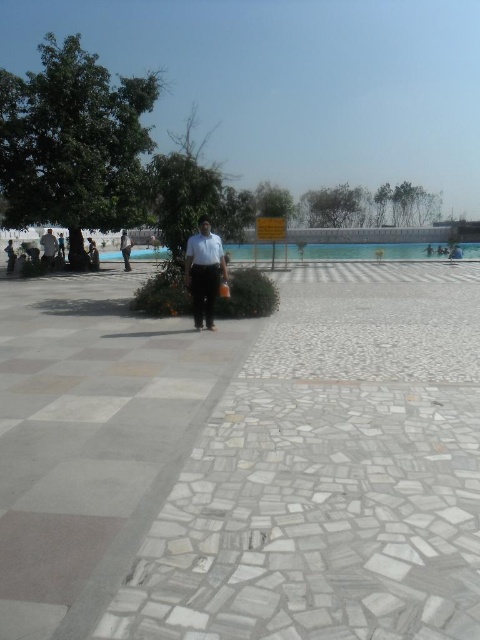
From the picture: Can you confirm if white matte shirt at center is wider than light blue fabric shirt at center?

Incorrect, white matte shirt at center's width does not surpass light blue fabric shirt at center's.

Is white matte shirt at center further to the viewer compared to light blue fabric shirt at center?

No.

Is point (210, 282) positioned behind point (126, 260)?

No, it is not.

This screenshot has height=640, width=480. I want to click on white matte shirt at center, so click(x=204, y=273).

Who is more distant from viewer, [404,547] or [57,241]?

The point [57,241] is more distant.

Can you confirm if white mosaic pavement at center is wider than light brown leather jacket at left?

Yes.

Is point (67, 362) more distant than point (55, 256)?

That is False.

At what (x,y) coordinates should I click in order to perform the action: click on white mosaic pavement at center. Please return your answer as a coordinate pair (x, y). This screenshot has height=640, width=480. Looking at the image, I should click on (242, 461).

How far apart are green leafy tree at upper left and clear glass pool at center?

They are 81.15 feet apart.

Is green leafy tree at upper left wider than clear glass pool at center?

Yes.

Find the location of a particular element. The image size is (480, 640). green leafy tree at upper left is located at coordinates pos(73,144).